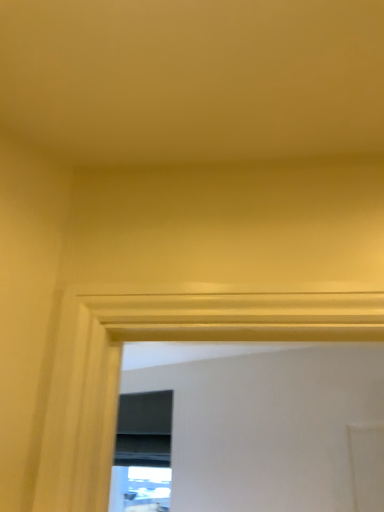
Describe the element at coordinates (142, 445) in the screenshot. I see `transparent glass window at center` at that location.

Where is `transparent glass window at center`? transparent glass window at center is located at coordinates (142, 445).

This screenshot has width=384, height=512. What are the coordinates of `transparent glass window at center` in the screenshot? It's located at (142, 445).